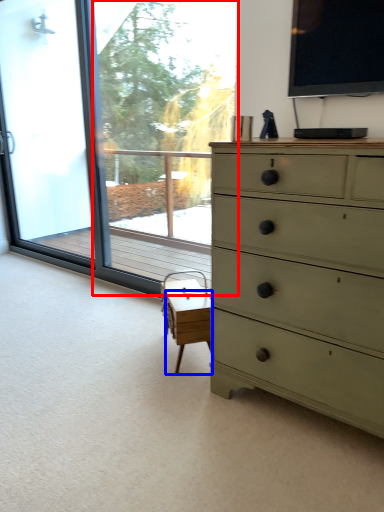
Question: Which point is further to the camera, window screen (highlighted by a red box) or table (highlighted by a blue box)?

Choices:
 (A) window screen
 (B) table

Answer: (A)